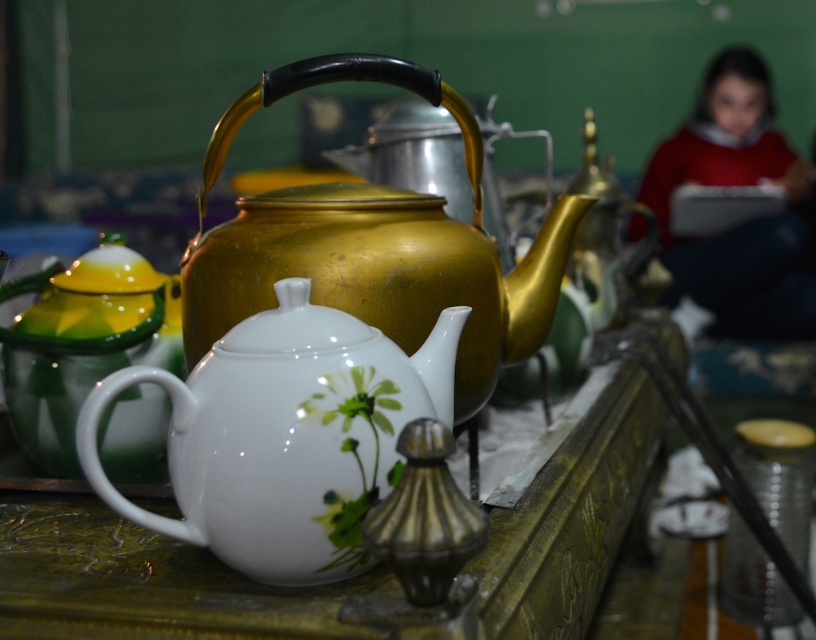
You are at a market and see the green glossy teapot at left and the red sweater at upper right. Which item is located more to the left side?

The green glossy teapot at left is more on the left side than the red sweater at upper right.

From the picture: You are a customer at a teapot exhibition and want to choose a teapot that can hold more tea. Based on the image, which teapot between the white glossy teapot at center and the green glossy teapot at left would you choose?

The white glossy teapot at center has a larger width than the green glossy teapot at left, so it can hold more tea.